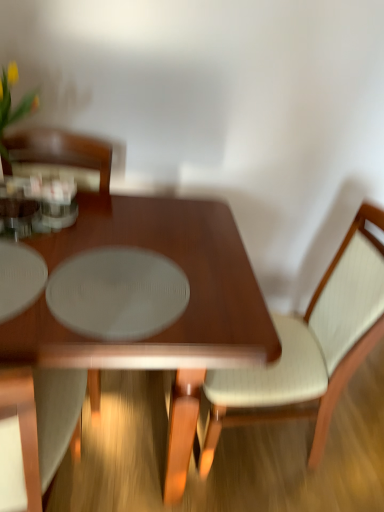
Question: Could you tell me if shiny brown table at center is facing white fabric chair at left, acting as the 2th chair starting from the right?

Choices:
 (A) yes
 (B) no

Answer: (A)

Question: Does shiny brown table at center have a greater width compared to white fabric chair at left, acting as the 2th chair starting from the right?

Choices:
 (A) yes
 (B) no

Answer: (A)

Question: From the image's perspective, is shiny brown table at center located beneath white fabric chair at left, the 1th chair from the left?

Choices:
 (A) yes
 (B) no

Answer: (B)

Question: Is shiny brown table at center thinner than white fabric chair at left, acting as the 2th chair starting from the right?

Choices:
 (A) yes
 (B) no

Answer: (B)

Question: Is shiny brown table at center behind white fabric chair at left, acting as the 2th chair starting from the right?

Choices:
 (A) yes
 (B) no

Answer: (A)

Question: Is shiny brown table at center bigger than white fabric chair at left, acting as the 2th chair starting from the right?

Choices:
 (A) yes
 (B) no

Answer: (A)

Question: Is light beige fabric chair at center, positioned as the first chair in right-to-left order, beside white fabric chair at left, acting as the 2th chair starting from the right?

Choices:
 (A) yes
 (B) no

Answer: (B)

Question: Is light beige fabric chair at center, placed as the 2th chair when sorted from left to right, not near white fabric chair at left, the 1th chair from the left?

Choices:
 (A) yes
 (B) no

Answer: (B)

Question: From a real-world perspective, is light beige fabric chair at center, positioned as the first chair in right-to-left order, physically below white fabric chair at left, the 1th chair from the left?

Choices:
 (A) no
 (B) yes

Answer: (B)

Question: Is light beige fabric chair at center, placed as the 2th chair when sorted from left to right, oriented towards white fabric chair at left, acting as the 2th chair starting from the right?

Choices:
 (A) yes
 (B) no

Answer: (B)

Question: From a real-world perspective, is light beige fabric chair at center, positioned as the first chair in right-to-left order, over white fabric chair at left, the 1th chair from the left?

Choices:
 (A) yes
 (B) no

Answer: (B)

Question: Is light beige fabric chair at center, placed as the 2th chair when sorted from left to right, to the right of white fabric chair at left, acting as the 2th chair starting from the right, from the viewer's perspective?

Choices:
 (A) yes
 (B) no

Answer: (A)

Question: Is there a large distance between white fabric chair at left, acting as the 2th chair starting from the right, and shiny brown table at center?

Choices:
 (A) yes
 (B) no

Answer: (B)